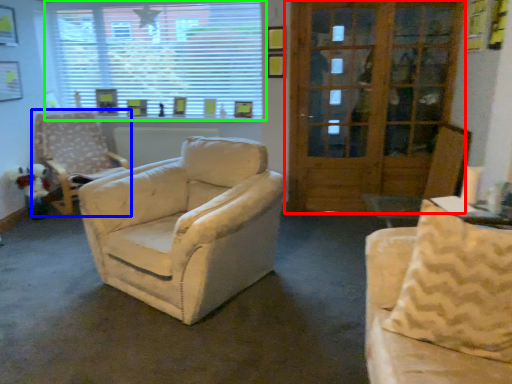
Question: Estimate the real-world distances between objects in this image. Which object is closer to door (highlighted by a red box), chair (highlighted by a blue box) or window (highlighted by a green box)?

Choices:
 (A) chair
 (B) window

Answer: (B)